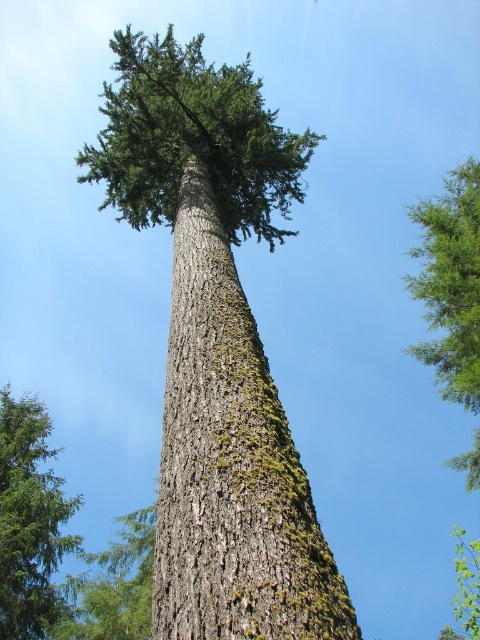
Who is taller, green mossy tree at lower left or green textured leaves at upper right?

Standing taller between the two is green textured leaves at upper right.

Between green mossy tree at lower left and green textured leaves at upper right, which one has less height?

With less height is green mossy tree at lower left.

Measure the distance between green mossy tree at lower left and camera.

13.21 meters

The image size is (480, 640). Identify the location of green mossy tree at lower left. (29, 520).

Which is in front, point (193, 320) or point (60, 509)?

Point (193, 320)

Does green mossy bark at center appear over green mossy tree at lower left?

Yes, green mossy bark at center is above green mossy tree at lower left.

Is point (201, 205) behind point (0, 611)?

No.

Image resolution: width=480 pixels, height=640 pixels. What are the coordinates of `green mossy bark at center` in the screenshot? It's located at pyautogui.click(x=230, y=464).

Does green mossy bark at center have a greater height compared to green textured leaves at upper right?

Incorrect, green mossy bark at center's height is not larger of green textured leaves at upper right's.

Does green mossy bark at center have a lesser width compared to green textured leaves at upper right?

Indeed, green mossy bark at center has a lesser width compared to green textured leaves at upper right.

Which is in front, point (273, 465) or point (434, 268)?

Point (273, 465) is in front.

Identify the location of green mossy bark at center. (230, 464).